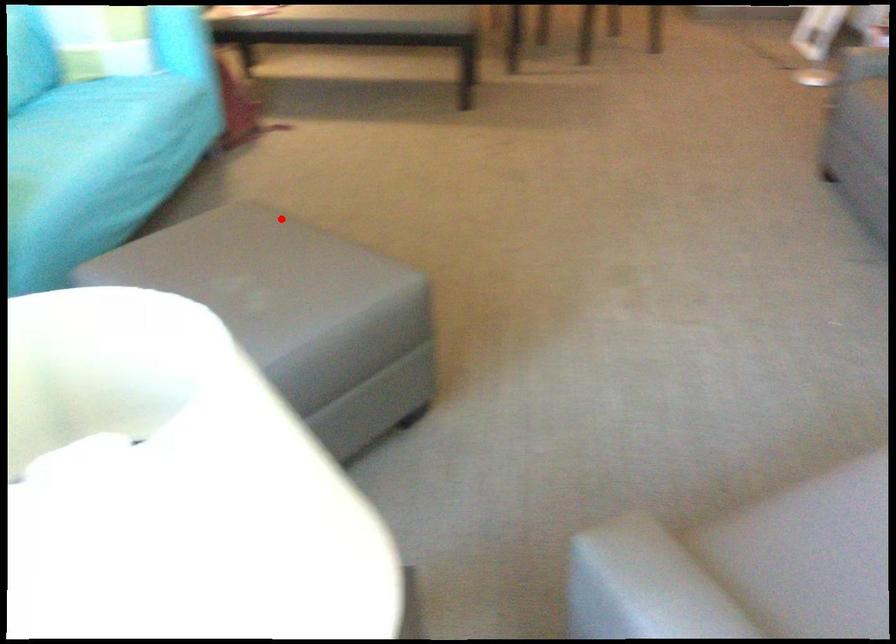
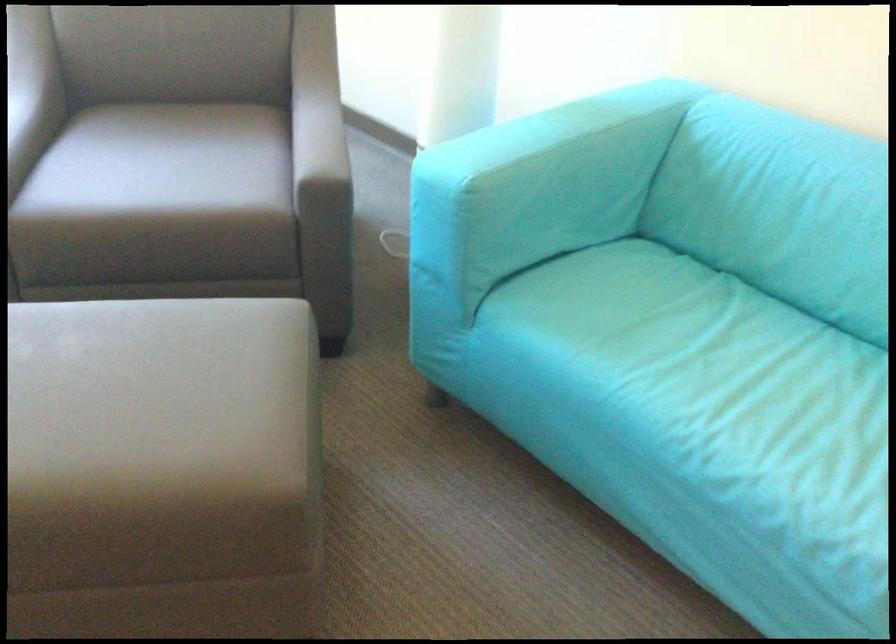
In the second image, find the point that corresponds to the highlighted location in the first image.

(162, 469)